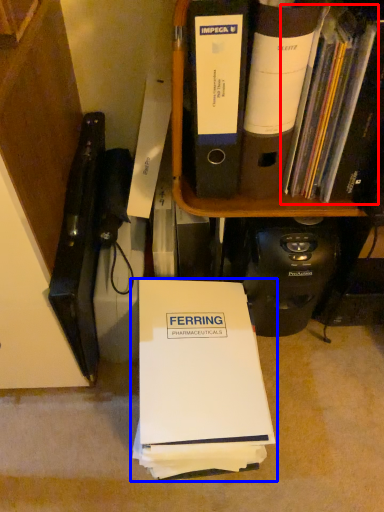
Question: Which of the following is the closest to the observer, book (highlighted by a red box) or book (highlighted by a blue box)?

Choices:
 (A) book
 (B) book

Answer: (A)